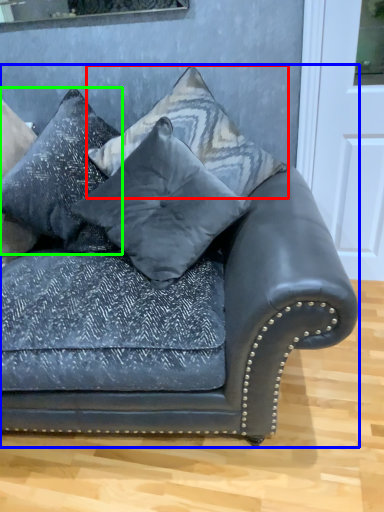
Question: Which is farther away from pillow (highlighted by a red box)? studio couch (highlighted by a blue box) or pillow (highlighted by a green box)?

Choices:
 (A) studio couch
 (B) pillow

Answer: (A)